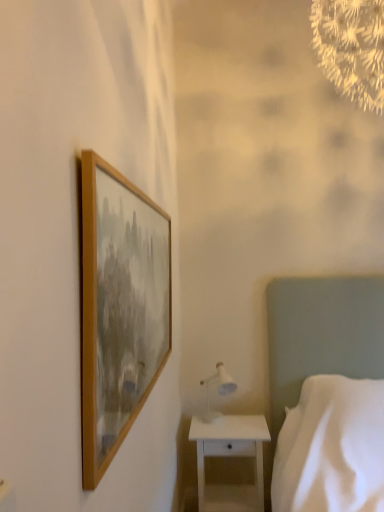
Question: Is white glossy nightstand at lower right at the left side of white glossy table lamp at lower right?

Choices:
 (A) yes
 (B) no

Answer: (B)

Question: From the image's perspective, is white glossy nightstand at lower right above white glossy table lamp at lower right?

Choices:
 (A) yes
 (B) no

Answer: (B)

Question: Is white glossy nightstand at lower right bigger than white glossy table lamp at lower right?

Choices:
 (A) no
 (B) yes

Answer: (B)

Question: Does white glossy nightstand at lower right have a greater width compared to white glossy table lamp at lower right?

Choices:
 (A) no
 (B) yes

Answer: (B)

Question: Can you confirm if white glossy nightstand at lower right is smaller than white glossy table lamp at lower right?

Choices:
 (A) yes
 (B) no

Answer: (B)

Question: From the image's perspective, is white fabric bed at right positioned above or below wooden frame at upper left?

Choices:
 (A) above
 (B) below

Answer: (B)

Question: From a real-world perspective, is white fabric bed at right above or below wooden frame at upper left?

Choices:
 (A) below
 (B) above

Answer: (A)

Question: Does point [x=342, y=327] appear closer or farther from the camera than point [x=89, y=202]?

Choices:
 (A) farther
 (B) closer

Answer: (A)

Question: Relative to wooden frame at upper left, is white fabric bed at right in front or behind?

Choices:
 (A) front
 (B) behind

Answer: (A)

Question: Is point (213, 388) positioned closer to the camera than point (132, 287)?

Choices:
 (A) closer
 (B) farther

Answer: (B)

Question: Relative to wooden frame at upper left, is white glossy table lamp at lower right in front or behind?

Choices:
 (A) front
 (B) behind

Answer: (B)

Question: Based on their sizes in the image, would you say white glossy table lamp at lower right is bigger or smaller than wooden frame at upper left?

Choices:
 (A) small
 (B) big

Answer: (A)

Question: From the image's perspective, is white glossy table lamp at lower right positioned above or below wooden frame at upper left?

Choices:
 (A) above
 (B) below

Answer: (B)

Question: Is wooden frame at upper left in front of or behind white glossy nightstand at lower right in the image?

Choices:
 (A) behind
 (B) front

Answer: (B)

Question: Is point (109, 406) positioned closer to the camera than point (210, 510)?

Choices:
 (A) closer
 (B) farther

Answer: (A)